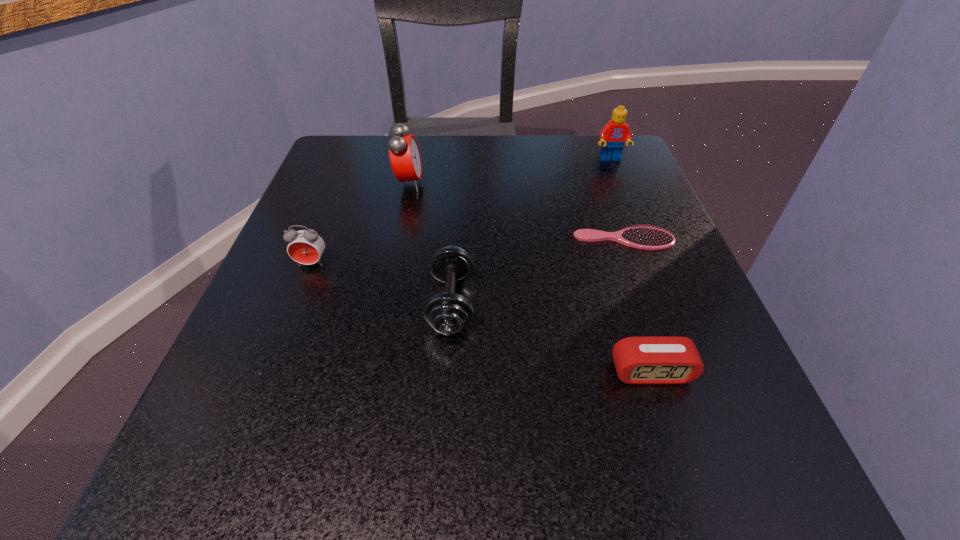
At what (x,y) coordinates should I click in order to perform the action: click on Lego that is at the right edge. Please return your answer as a coordinate pair (x, y). Looking at the image, I should click on (614, 134).

I want to click on alarm clock located in the right edge section of the desktop, so click(655, 359).

The width and height of the screenshot is (960, 540). Identify the location of hairbrush positioned at the right edge. (646, 238).

The image size is (960, 540). I want to click on object located at the far right corner, so click(614, 134).

The width and height of the screenshot is (960, 540). I want to click on free space at the far edge, so click(505, 155).

Image resolution: width=960 pixels, height=540 pixels. I want to click on free space at the near edge of the desktop, so click(x=407, y=497).

This screenshot has width=960, height=540. I want to click on blank space at the left edge, so click(359, 230).

This screenshot has width=960, height=540. In the image, there is a desktop. Find the location of `vacant space at the right edge`. vacant space at the right edge is located at coordinates (609, 223).

The image size is (960, 540). In the image, there is a desktop. Find the location of `vacant space at the far left corner`. vacant space at the far left corner is located at coordinates (326, 177).

The height and width of the screenshot is (540, 960). Identify the location of free space at the far right corner of the desktop. (626, 172).